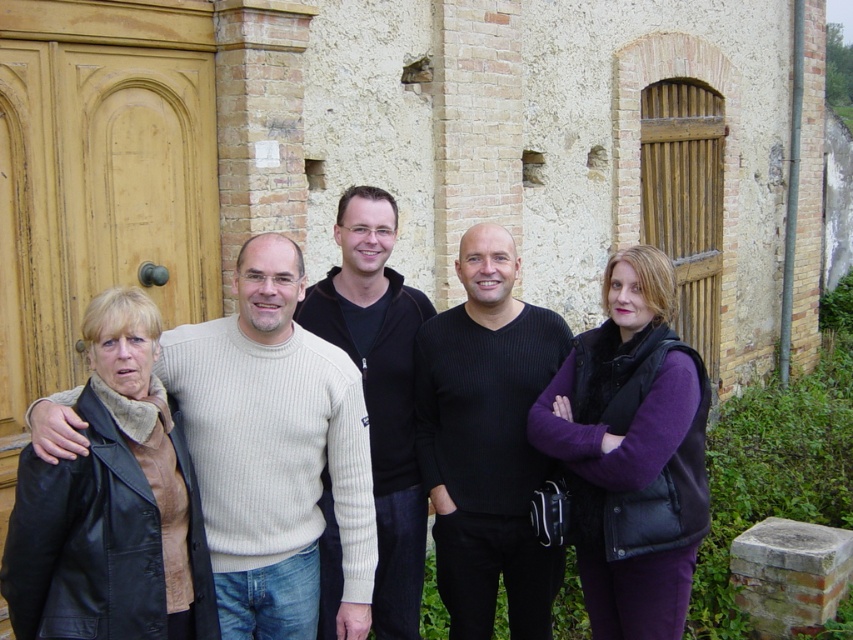
Question: Which point is closer to the camera?

Choices:
 (A) matte black jacket at center
 (B) purple matte vest at center
 (C) light beige sweater at center
 (D) black ribbed sweater at center

Answer: (C)

Question: Which object appears closest to the camera in this image?

Choices:
 (A) black ribbed sweater at center
 (B) black leather jacket at lower left
 (C) purple matte vest at center
 (D) light beige sweater at center

Answer: (B)

Question: Is matte black jacket at center closer to the viewer compared to black zip-up sweater at center?

Choices:
 (A) no
 (B) yes

Answer: (B)

Question: Does purple matte vest at center come behind black zip-up sweater at center?

Choices:
 (A) yes
 (B) no

Answer: (B)

Question: Does black leather jacket at lower left appear under black ribbed sweater at center?

Choices:
 (A) no
 (B) yes

Answer: (B)

Question: Which object appears closest to the camera in this image?

Choices:
 (A) matte black jacket at center
 (B) black zip-up sweater at center

Answer: (A)